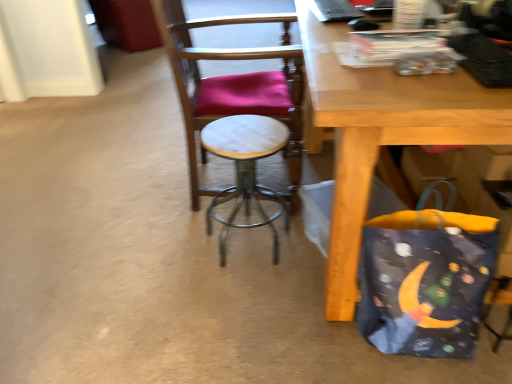
Where is `free point below white marble stool at center (from a real-world perspective)`? free point below white marble stool at center (from a real-world perspective) is located at coordinates (246, 248).